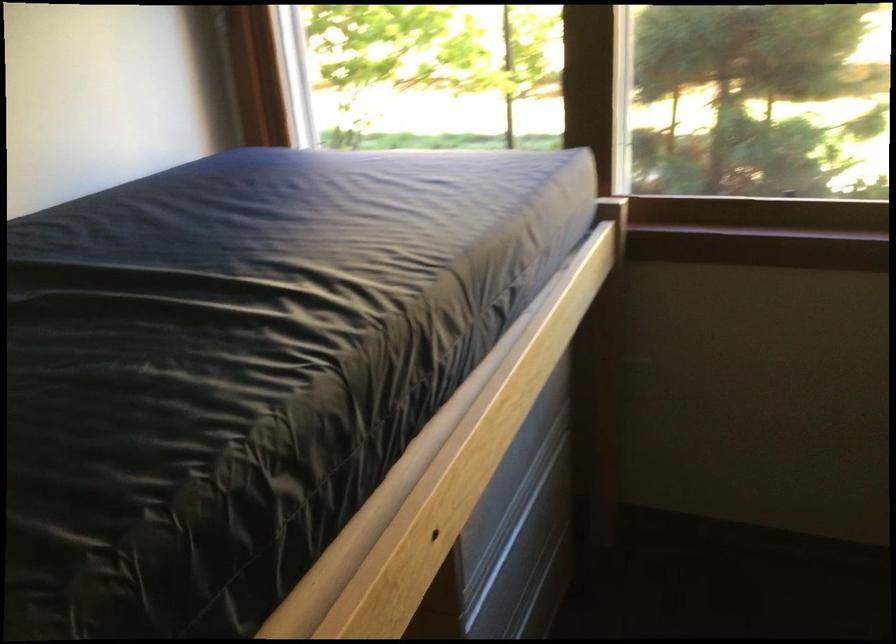
Find where to grip the wooden bed rail. Please return your answer as a coordinate pair (x, y).

(467, 478)